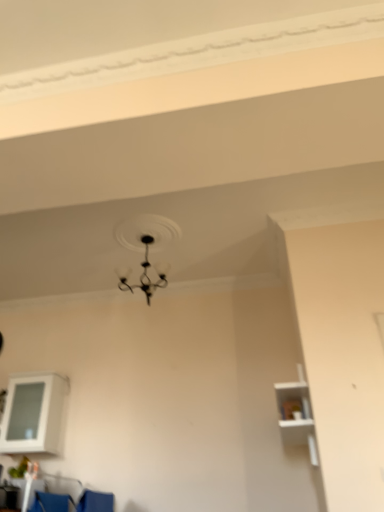
Question: Does black matte chandelier at upper center have a lesser height compared to white matte shelf at right, arranged as the first shelf when viewed from the front?

Choices:
 (A) no
 (B) yes

Answer: (B)

Question: Is black matte chandelier at upper center in contact with white matte shelf at right, the second shelf when ordered from left to right?

Choices:
 (A) no
 (B) yes

Answer: (A)

Question: Is black matte chandelier at upper center positioned with its back to white matte shelf at right, the second shelf when ordered from left to right?

Choices:
 (A) no
 (B) yes

Answer: (A)

Question: Is black matte chandelier at upper center to the right of white matte shelf at right, the 2th shelf in the back-to-front sequence, from the viewer's perspective?

Choices:
 (A) yes
 (B) no

Answer: (B)

Question: From the image's perspective, is black matte chandelier at upper center over white matte shelf at right, the second shelf when ordered from left to right?

Choices:
 (A) no
 (B) yes

Answer: (B)

Question: Is black matte chandelier at upper center behind white matte shelf at right, the 2th shelf in the back-to-front sequence?

Choices:
 (A) yes
 (B) no

Answer: (A)

Question: Can black matte chandelier at upper center be found inside white matte shelf at right, arranged as the first shelf when viewed from the front?

Choices:
 (A) no
 (B) yes

Answer: (A)

Question: From the image's perspective, would you say white matte shelf at right, arranged as the first shelf when viewed from the front, is shown under black matte chandelier at upper center?

Choices:
 (A) no
 (B) yes

Answer: (B)

Question: Is white matte shelf at right, arranged as the first shelf when viewed from the front, facing away from black matte chandelier at upper center?

Choices:
 (A) yes
 (B) no

Answer: (B)

Question: From a real-world perspective, is white matte shelf at right, the second shelf when ordered from left to right, located beneath black matte chandelier at upper center?

Choices:
 (A) no
 (B) yes

Answer: (B)

Question: Does white matte shelf at right, which is the first shelf in right-to-left order, have a greater height compared to black matte chandelier at upper center?

Choices:
 (A) yes
 (B) no

Answer: (A)

Question: From the image's perspective, does white matte shelf at right, arranged as the first shelf when viewed from the front, appear higher than black matte chandelier at upper center?

Choices:
 (A) yes
 (B) no

Answer: (B)

Question: Can you confirm if white glossy cabinet at lower left, marked as the 2th shelf in a front-to-back arrangement, is shorter than blue fabric armchair at lower left?

Choices:
 (A) no
 (B) yes

Answer: (A)